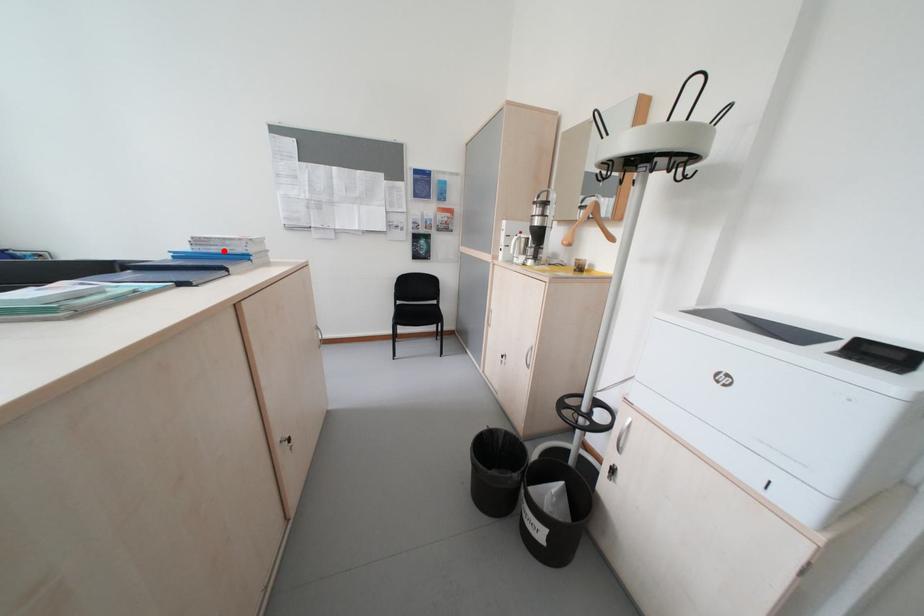
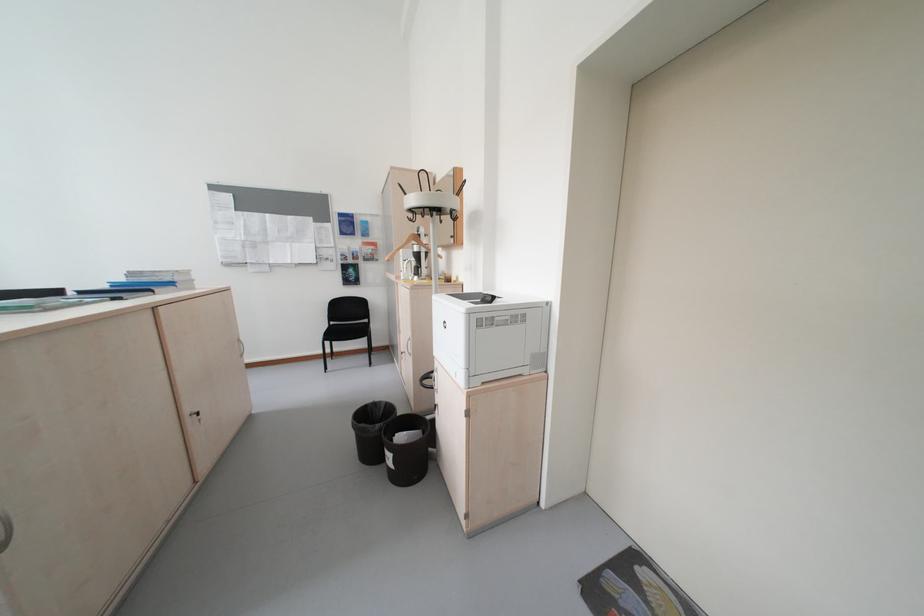
Where in the second image is the point corresponding to the highlighted location from the first image?

(155, 281)